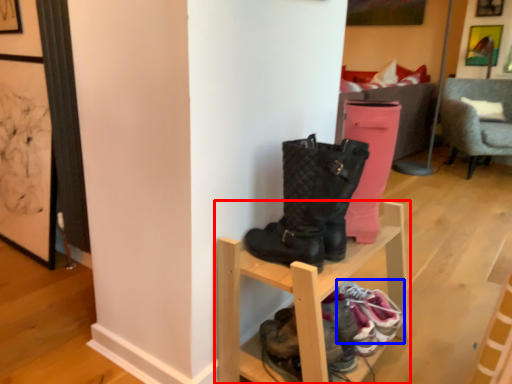
Question: Which point is closer to the camera, shelf (highlighted by a red box) or footwear (highlighted by a blue box)?

Choices:
 (A) shelf
 (B) footwear

Answer: (A)